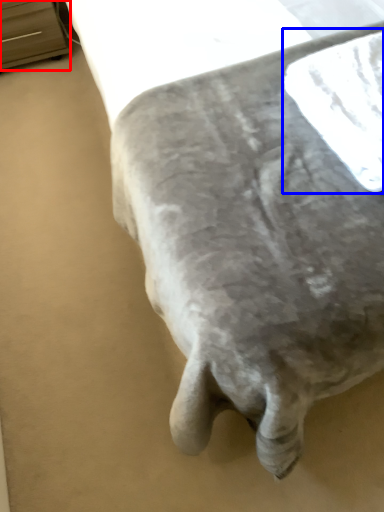
Question: Which object is further to the camera taking this photo, furniture (highlighted by a red box) or linen (highlighted by a blue box)?

Choices:
 (A) furniture
 (B) linen

Answer: (A)